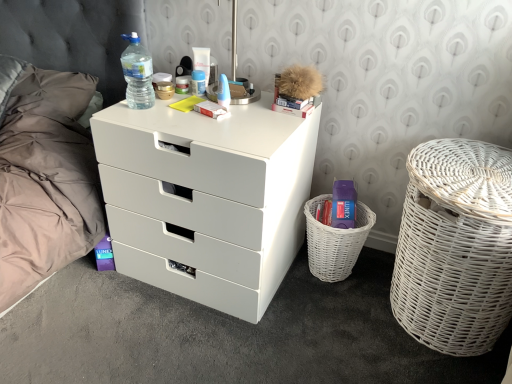
The width and height of the screenshot is (512, 384). Find the location of `vacant position to the left of blue plastic toothbrush at upper center, the fourth toiletry when ordered from left to right`. vacant position to the left of blue plastic toothbrush at upper center, the fourth toiletry when ordered from left to right is located at coordinates (176, 99).